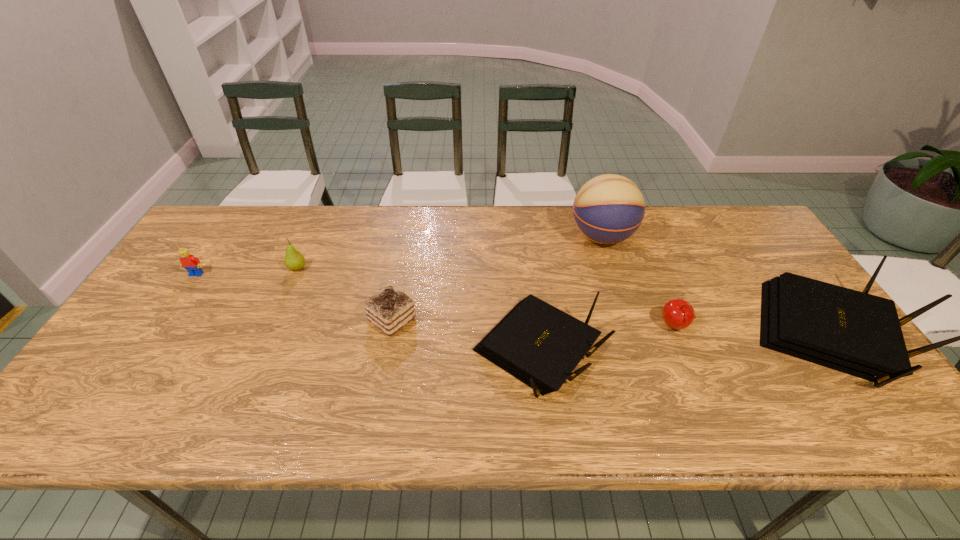
Where is `free region at the near edge of the desktop`? The width and height of the screenshot is (960, 540). free region at the near edge of the desktop is located at coordinates (598, 379).

The width and height of the screenshot is (960, 540). In the image, there is a desktop. Find the location of `free region at the left edge`. free region at the left edge is located at coordinates (178, 286).

The image size is (960, 540). What are the coordinates of `free region at the near right corner of the desktop` in the screenshot? It's located at [806, 380].

Identify the location of free space between the cherry and the basketball. The image size is (960, 540). (638, 282).

You are a GUI agent. You are given a task and a screenshot of the screen. Output one action in this format:
    pyautogui.click(x=<x>, y=<y>)
    Task: Click on the free point between the second object from left to right and the cherry
    
    Given the screenshot: What is the action you would take?
    pyautogui.click(x=486, y=298)

Where is `vacant space in between the sixth object from right to left and the cherry`? This screenshot has width=960, height=540. vacant space in between the sixth object from right to left and the cherry is located at coordinates (x=486, y=298).

You are a GUI agent. You are given a task and a screenshot of the screen. Output one action in this format:
    pyautogui.click(x=<x>, y=<y>)
    Task: Click on the free area in between the shorter router and the farthest object
    This screenshot has height=540, width=960.
    Given the screenshot: What is the action you would take?
    (569, 294)

Locate an element on the screen. Image resolution: width=960 pixels, height=540 pixels. free space between the pear and the tallest object is located at coordinates (449, 252).

The width and height of the screenshot is (960, 540). I want to click on free spot between the pear and the chocolate cake, so point(345,294).

Locate which object is the sixth closest to the fifth object from right to left. Please provide its 2D coordinates. Your answer should be formatted as a tuple, i.e. [(x, y)], where the tuple contains the x and y coordinates of a point satisfying the conditions above.

[(853, 332)]